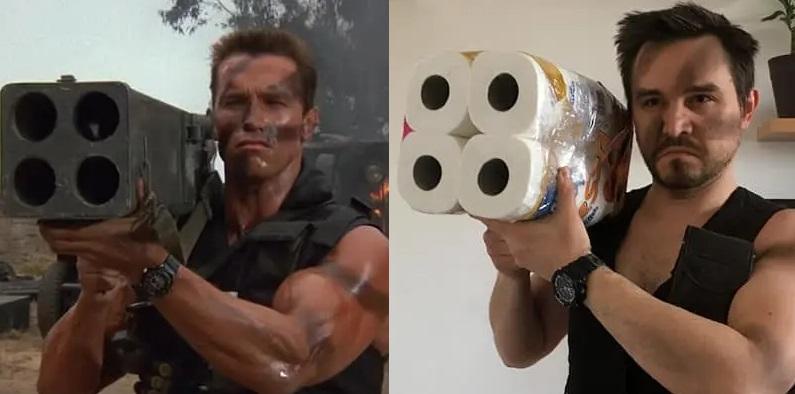
The width and height of the screenshot is (795, 394). Identify the location of wood shelf. (781, 131).